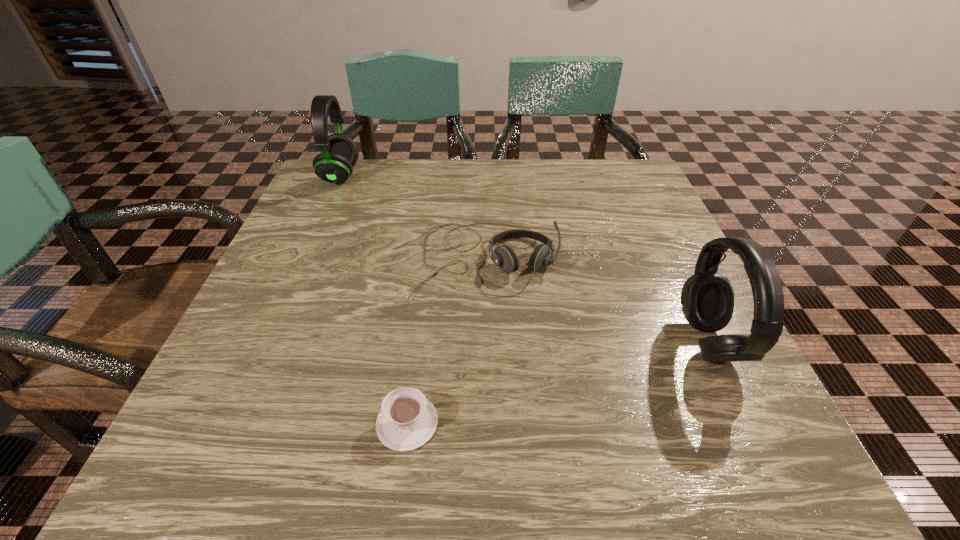
Where is `free space located 0.390m on the earcups of the rightmost object`? free space located 0.390m on the earcups of the rightmost object is located at coordinates (449, 342).

In order to click on free space located on the outer surface of the shortest headset in this screenshot , I will do `click(486, 332)`.

What are the coordinates of `free space located on the handle side of the shortest object` in the screenshot? It's located at (299, 423).

Locate an element on the screen. free point located on the handle side of the shortest object is located at coordinates (313, 423).

Locate an element on the screen. This screenshot has height=540, width=960. free space located on the handle side of the shortest object is located at coordinates (199, 423).

The height and width of the screenshot is (540, 960). What are the coordinates of `object positioned at the far edge` in the screenshot? It's located at (339, 153).

Locate an element on the screen. object situated at the near edge is located at coordinates (407, 420).

Where is `object that is at the left edge`? This screenshot has width=960, height=540. object that is at the left edge is located at coordinates (339, 153).

The height and width of the screenshot is (540, 960). In order to click on object present at the right edge in this screenshot , I will do `click(707, 297)`.

Image resolution: width=960 pixels, height=540 pixels. In order to click on object located at the far left corner in this screenshot , I will do tap(339, 153).